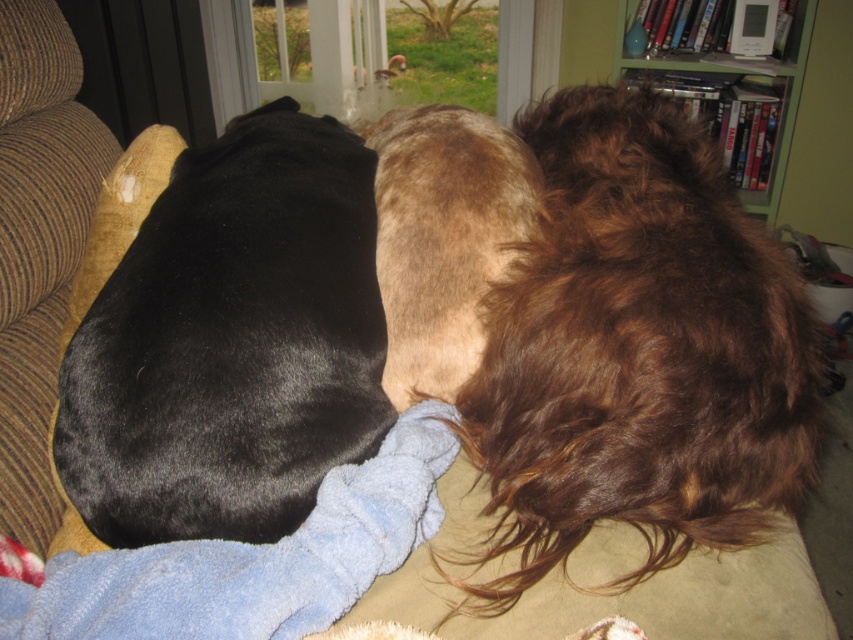
You are a delivery robot that is 2.5 feet wide. You need to move from the entrance to the living room through the space between the green wood bookshelf at upper right and the transparent glass door at upper center. Can you fit through that space?

The space between the green wood bookshelf at upper right and the transparent glass door at upper center is 3.90 feet wide. Since the robot is 2.5 feet wide, it can fit through the space as the width is sufficient.

You are a photographer standing in front of the couch where the brown fuzzy dog at center is resting. You want to take a closeup photo of the dog without moving any other objects. Can you get within 1 meter to take the photo?

The distance of brown fuzzy dog at center from camera is 1.01 meters, so you can get within 1 meter by moving just 1 centimeter closer.

You are a delivery person trying to bring a large package through the transparent glass door at upper center. The brown fuzzy dog at center is blocking the path. Can the package be delivered without moving the dog?

The brown fuzzy dog at center is taller than the transparent glass door at upper center, so the dog is likely blocking the doorway. To deliver the package, you would need to move the dog out of the way to clear the path.